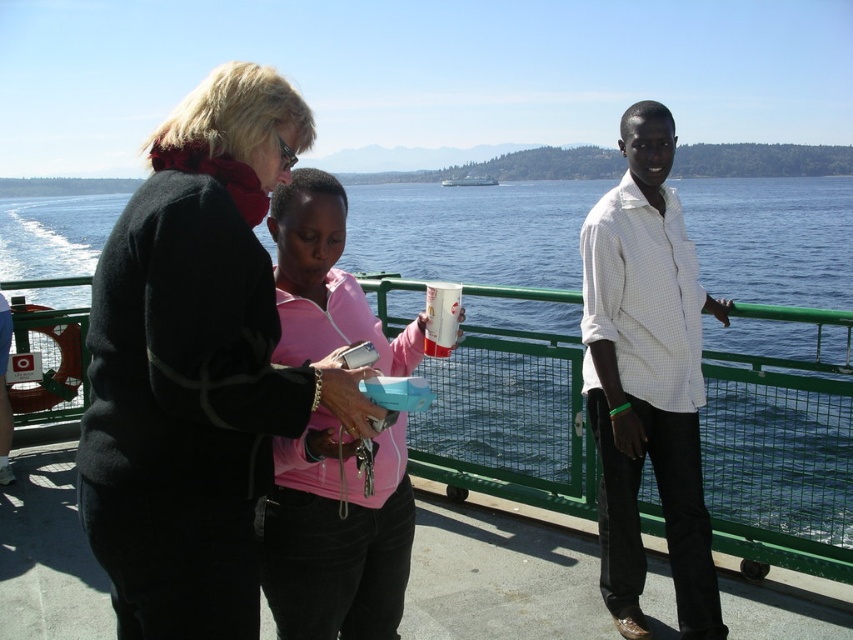
Who is taller, white checkered shirt at center or matte pink hoodie at center?

matte pink hoodie at center

Which is more to the right, white checkered shirt at center or matte pink hoodie at center?

Positioned to the right is white checkered shirt at center.

Is point (697, 504) positioned before point (337, 452)?

No, it is not.

Where is `white checkered shirt at center`? The image size is (853, 640). white checkered shirt at center is located at coordinates (647, 378).

Can you confirm if matte pink hoodie at center is shorter than white glossy cup at center?

Indeed, matte pink hoodie at center has a lesser height compared to white glossy cup at center.

Does point (340, 346) come closer to viewer compared to point (495, 182)?

Yes, it is.

The image size is (853, 640). What do you see at coordinates (337, 536) in the screenshot? I see `matte pink hoodie at center` at bounding box center [337, 536].

The width and height of the screenshot is (853, 640). Identify the location of matte pink hoodie at center. (337, 536).

Between green metal railing at center and white glossy cup at center, which one has more height?

white glossy cup at center is taller.

Is green metal railing at center positioned in front of white glossy cup at center?

Yes, it is in front of white glossy cup at center.

Who is more distant from viewer, (543, 406) or (482, 173)?

Positioned behind is point (482, 173).

Where is `green metal railing at center`? Image resolution: width=853 pixels, height=640 pixels. green metal railing at center is located at coordinates (780, 452).